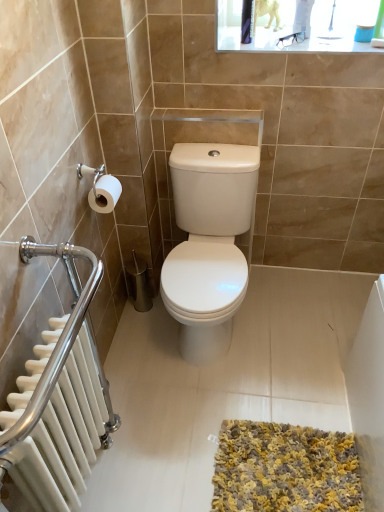
I want to click on blank space situated above yellow-grey shaggy bath mat at lower center (from a real-world perspective), so click(294, 461).